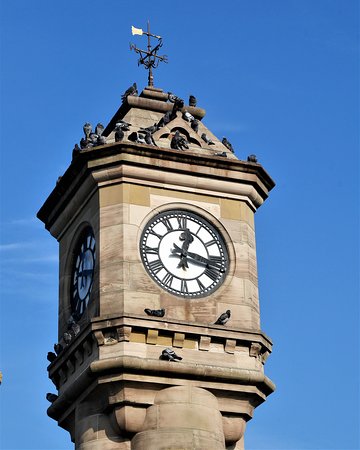
This screenshot has height=450, width=360. Identify the location of roman numeral clock. (172, 237).